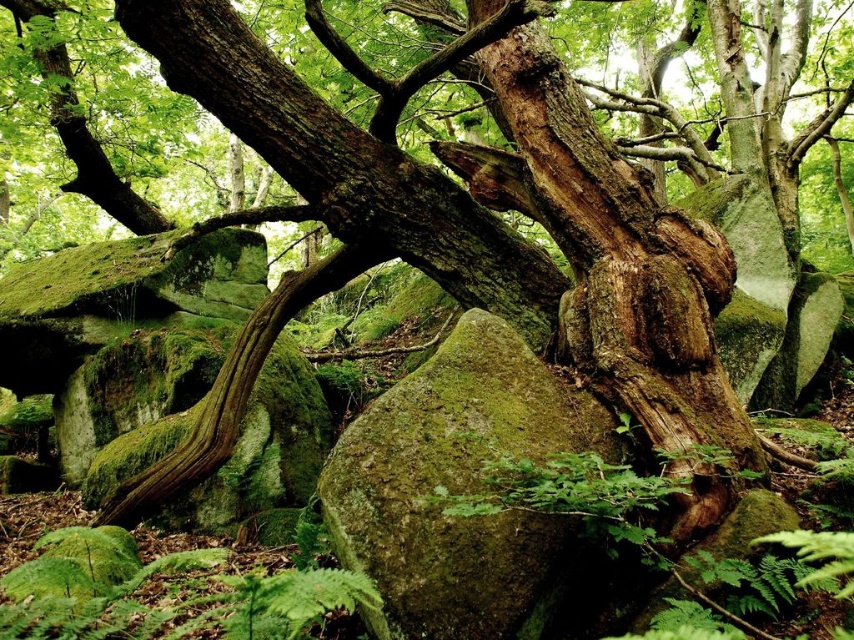
You are a hiker trying to take a photo of the green mossy rock at center and the green fuzzy fern at lower left. Which object should you focus on first if you want both to be in clear focus?

The green fuzzy fern at lower left is behind the green mossy rock at center, so you should focus on the green mossy rock at center first to ensure both are in focus.

You are standing at the edge of the forest and see a point marked at coordinates (464, 493). According to the scene, where exactly is this point located?

The point at (464, 493) is located on the green mossy rock at center.

You are standing in the forest scene and want to place a small marker at each of the two points. Which point, point (494, 614) or point (80, 563), is closer to you?

Point (494, 614) is closer to the viewer than point (80, 563).